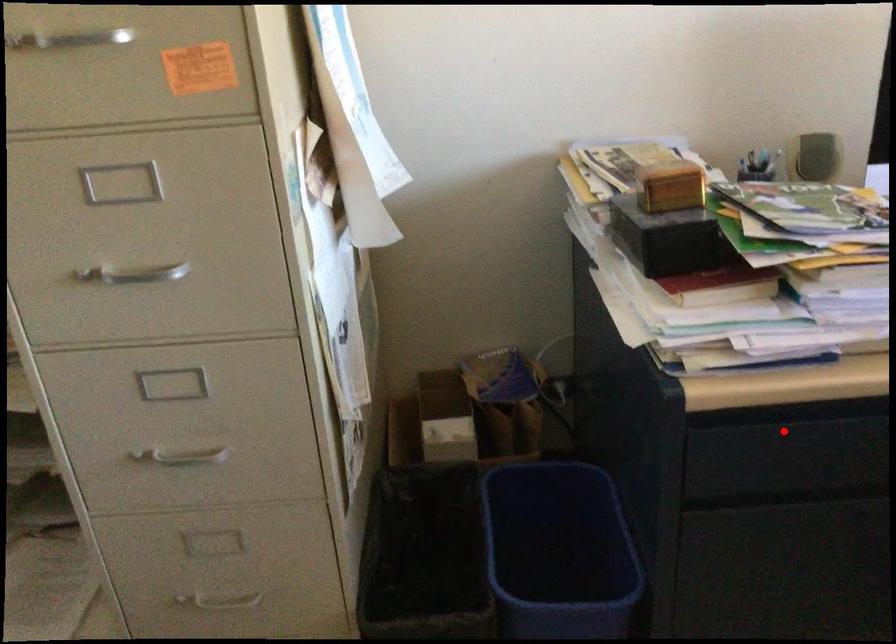
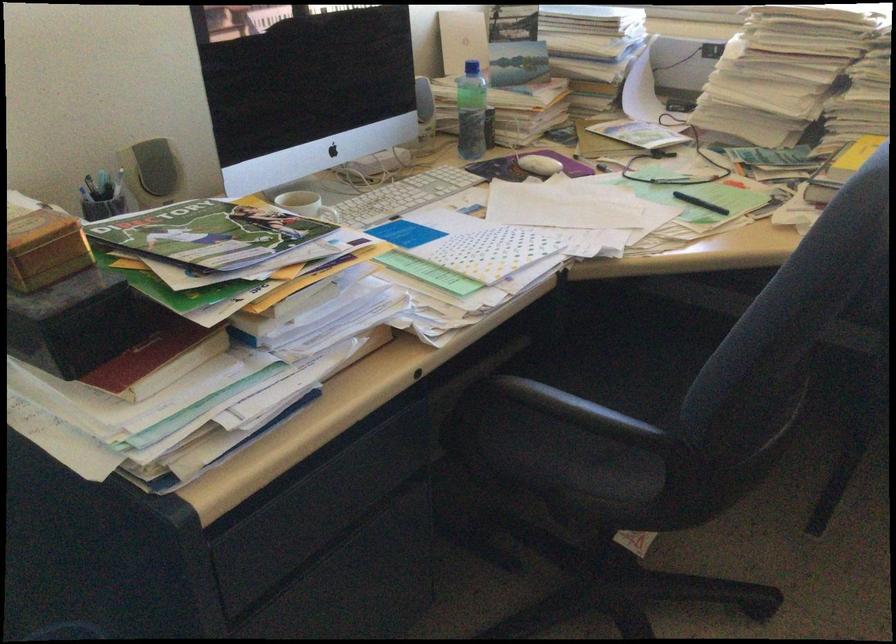
In the second image, find the point that corresponds to the highlighted location in the first image.

(300, 491)